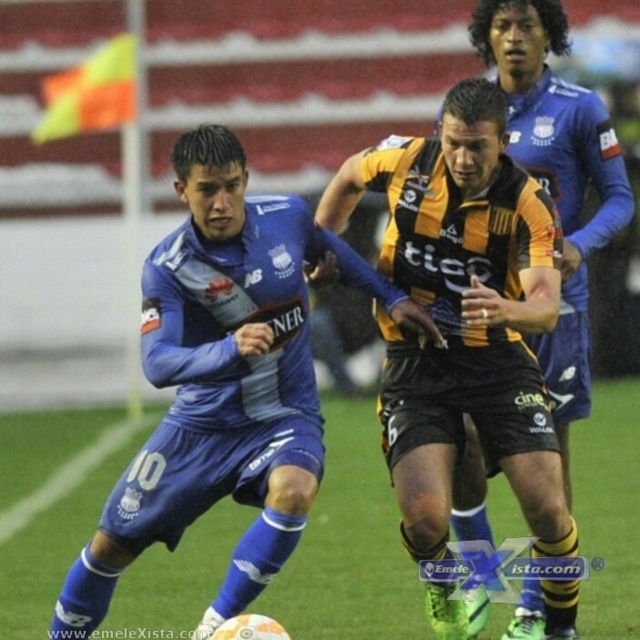
Question: Which point is farther to the camera?

Choices:
 (A) yellow-orange jersey at center
 (B) blue jersey at center

Answer: (A)

Question: Where is green grass at center located in relation to yellow-orange jersey at center in the image?

Choices:
 (A) left
 (B) right

Answer: (A)

Question: Is green grass at center positioned before yellow-orange jersey at center?

Choices:
 (A) no
 (B) yes

Answer: (A)

Question: Among these points, which one is nearest to the camera?

Choices:
 (A) (273, 394)
 (B) (348, 592)
 (C) (532, 32)

Answer: (A)

Question: Is green grass at center below yellow-orange jersey at center?

Choices:
 (A) no
 (B) yes

Answer: (B)

Question: Among these points, which one is nearest to the camera?

Choices:
 (A) (228, 424)
 (B) (616, 154)
 (C) (48, 547)

Answer: (A)